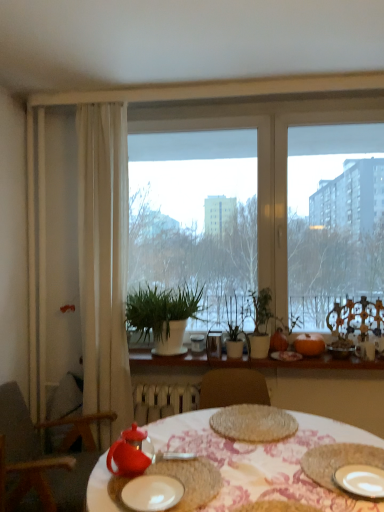
You are a GUI agent. You are given a task and a screenshot of the screen. Output one action in this format:
    pyautogui.click(x=<x>, y=<y>)
    Task: Click on the free location to the right of white matte plate at center, the 2th plate viewed from the right
    This screenshot has height=512, width=384.
    Given the screenshot: What is the action you would take?
    pyautogui.click(x=216, y=488)